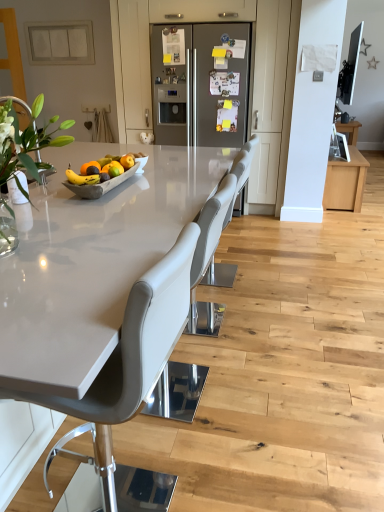
You are a GUI agent. You are given a task and a screenshot of the screen. Output one action in this format:
    pyautogui.click(x=<x>, y=<y>)
    Task: Click on the free spot in front of wooden tray at center
    
    Given the screenshot: What is the action you would take?
    pyautogui.click(x=115, y=212)